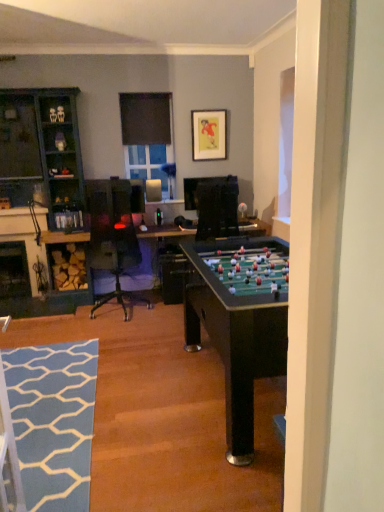
Question: Could you tell me if blue textured rug at lower left is turned towards matte black picture frame at upper center?

Choices:
 (A) no
 (B) yes

Answer: (A)

Question: Does blue textured rug at lower left have a smaller size compared to matte black picture frame at upper center?

Choices:
 (A) yes
 (B) no

Answer: (B)

Question: Is blue textured rug at lower left bigger than matte black picture frame at upper center?

Choices:
 (A) no
 (B) yes

Answer: (B)

Question: Would you say blue textured rug at lower left is a long distance from matte black picture frame at upper center?

Choices:
 (A) yes
 (B) no

Answer: (A)

Question: From a real-world perspective, is blue textured rug at lower left on matte black picture frame at upper center?

Choices:
 (A) no
 (B) yes

Answer: (A)

Question: Is blue textured rug at lower left beside matte black picture frame at upper center?

Choices:
 (A) no
 (B) yes

Answer: (A)

Question: From the image's perspective, is teal wood cabinet at left below black glass fireplace at lower left?

Choices:
 (A) yes
 (B) no

Answer: (B)

Question: Can you confirm if teal wood cabinet at left is shorter than black glass fireplace at lower left?

Choices:
 (A) no
 (B) yes

Answer: (A)

Question: Is teal wood cabinet at left in contact with black glass fireplace at lower left?

Choices:
 (A) yes
 (B) no

Answer: (B)

Question: Would you say teal wood cabinet at left is outside black glass fireplace at lower left?

Choices:
 (A) yes
 (B) no

Answer: (A)

Question: Can you confirm if teal wood cabinet at left is positioned to the right of black glass fireplace at lower left?

Choices:
 (A) no
 (B) yes

Answer: (B)

Question: Is teal wood cabinet at left bigger than black glass fireplace at lower left?

Choices:
 (A) no
 (B) yes

Answer: (B)

Question: Can you confirm if clear glass window at upper center, which is the first window screen in bottom-to-top order, is shorter than black matte window screen at upper center, the 1th window screen viewed from the top?

Choices:
 (A) no
 (B) yes

Answer: (A)